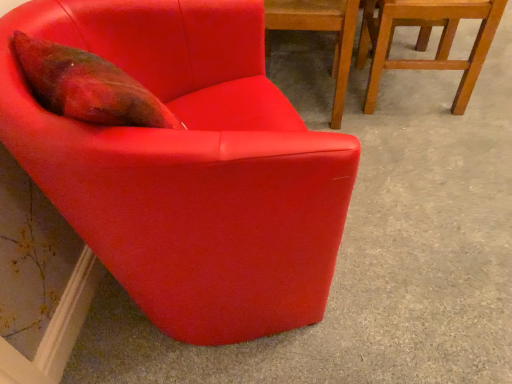
Question: Is wooden chair at upper right, which appears as the 3th chair when viewed from the left, behind matte red armchair at upper left, which is counted as the first chair, starting from the left?

Choices:
 (A) no
 (B) yes

Answer: (B)

Question: From the image's perspective, is wooden chair at upper right, which appears as the 3th chair when viewed from the left, below matte red armchair at upper left, arranged as the 3th chair when viewed from the right?

Choices:
 (A) yes
 (B) no

Answer: (B)

Question: Is wooden chair at upper right, which appears as the 3th chair when viewed from the left, directly adjacent to matte red armchair at upper left, arranged as the 3th chair when viewed from the right?

Choices:
 (A) yes
 (B) no

Answer: (B)

Question: Does wooden chair at upper right, which appears as the 3th chair when viewed from the left, appear on the left side of matte red armchair at upper left, arranged as the 3th chair when viewed from the right?

Choices:
 (A) no
 (B) yes

Answer: (A)

Question: Would you say wooden chair at upper right, which appears as the 1th chair when viewed from the right, contains matte red armchair at upper left, arranged as the 3th chair when viewed from the right?

Choices:
 (A) yes
 (B) no

Answer: (B)

Question: Considering the relative positions of wooden chair at upper right, which appears as the 3th chair when viewed from the left, and matte red armchair at upper left, which is counted as the first chair, starting from the left, in the image provided, is wooden chair at upper right, which appears as the 3th chair when viewed from the left, to the right of matte red armchair at upper left, which is counted as the first chair, starting from the left, from the viewer's perspective?

Choices:
 (A) yes
 (B) no

Answer: (A)

Question: From the image's perspective, does wooden chair at upper right, which appears as the 3th chair when viewed from the left, appear higher than matte red chair at center, which ranks as the 2th chair in left-to-right order?

Choices:
 (A) yes
 (B) no

Answer: (A)

Question: From a real-world perspective, is wooden chair at upper right, which appears as the 3th chair when viewed from the left, on matte red chair at center, the second chair positioned from the right?

Choices:
 (A) no
 (B) yes

Answer: (A)

Question: Can you confirm if wooden chair at upper right, which appears as the 1th chair when viewed from the right, is positioned to the right of matte red chair at center, the second chair positioned from the right?

Choices:
 (A) yes
 (B) no

Answer: (A)

Question: Is wooden chair at upper right, which appears as the 1th chair when viewed from the right, bigger than matte red chair at center, the second chair positioned from the right?

Choices:
 (A) no
 (B) yes

Answer: (A)

Question: Is wooden chair at upper right, which appears as the 1th chair when viewed from the right, beside matte red chair at center, the second chair positioned from the right?

Choices:
 (A) no
 (B) yes

Answer: (A)

Question: Is wooden chair at upper right, which appears as the 3th chair when viewed from the left, shorter than matte red chair at center, the second chair positioned from the right?

Choices:
 (A) yes
 (B) no

Answer: (A)

Question: Does matte red armchair at upper left, which is counted as the first chair, starting from the left, come behind wooden chair at upper right, which appears as the 1th chair when viewed from the right?

Choices:
 (A) yes
 (B) no

Answer: (B)